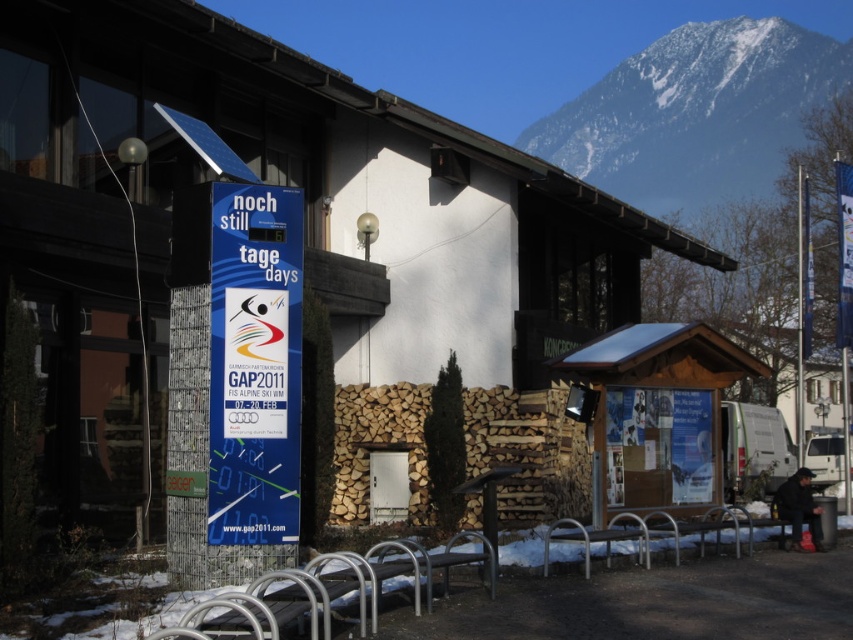
Question: In this image, where is snowy granite mountain at upper right located relative to blue plastic sign at center?

Choices:
 (A) right
 (B) left

Answer: (A)

Question: Which point is farther to the camera?

Choices:
 (A) snowy granite mountain at upper right
 (B) blue plastic sign at center

Answer: (A)

Question: Which point is closer to the camera?

Choices:
 (A) blue plastic sign at center
 (B) snowy granite mountain at upper right

Answer: (A)

Question: Is snowy granite mountain at upper right to the left of blue plastic sign at center from the viewer's perspective?

Choices:
 (A) no
 (B) yes

Answer: (A)

Question: Which object is farther from the camera taking this photo?

Choices:
 (A) snowy granite mountain at upper right
 (B) blue plastic sign at center

Answer: (A)

Question: Can you confirm if snowy granite mountain at upper right is positioned to the right of blue plastic sign at center?

Choices:
 (A) yes
 (B) no

Answer: (A)